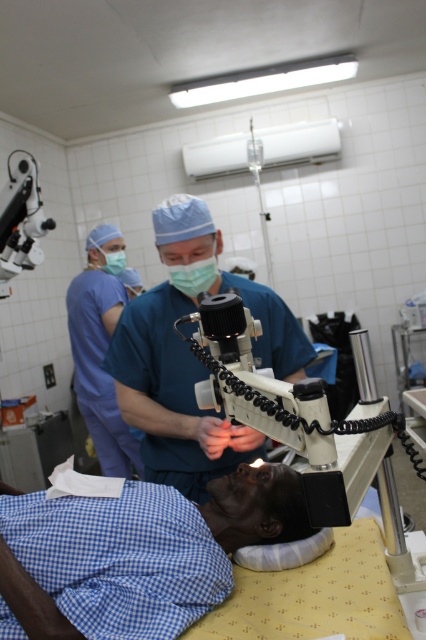
Question: Does white plastic microscope at center have a smaller size compared to matte black microscope at upper left?

Choices:
 (A) no
 (B) yes

Answer: (A)

Question: Among these objects, which one is nearest to the camera?

Choices:
 (A) blue checkered fabric at lower left
 (B) white plastic microscope at center
 (C) matte green mask at center

Answer: (B)

Question: Which point appears closest to the camera in this image?

Choices:
 (A) (290, 321)
 (B) (14, 208)
 (C) (147, 595)

Answer: (C)

Question: Does blue checkered fabric at lower left have a lesser width compared to matte black microscope at upper left?

Choices:
 (A) yes
 (B) no

Answer: (B)

Question: Can you confirm if teal matte/soft scrubs at center is positioned to the right of green matte mask at upper left?

Choices:
 (A) yes
 (B) no

Answer: (A)

Question: Which object appears closest to the camera in this image?

Choices:
 (A) blue checkered fabric at lower left
 (B) teal matte/soft scrubs at center
 (C) blue scrubs at center
 (D) matte green mask at center

Answer: (A)